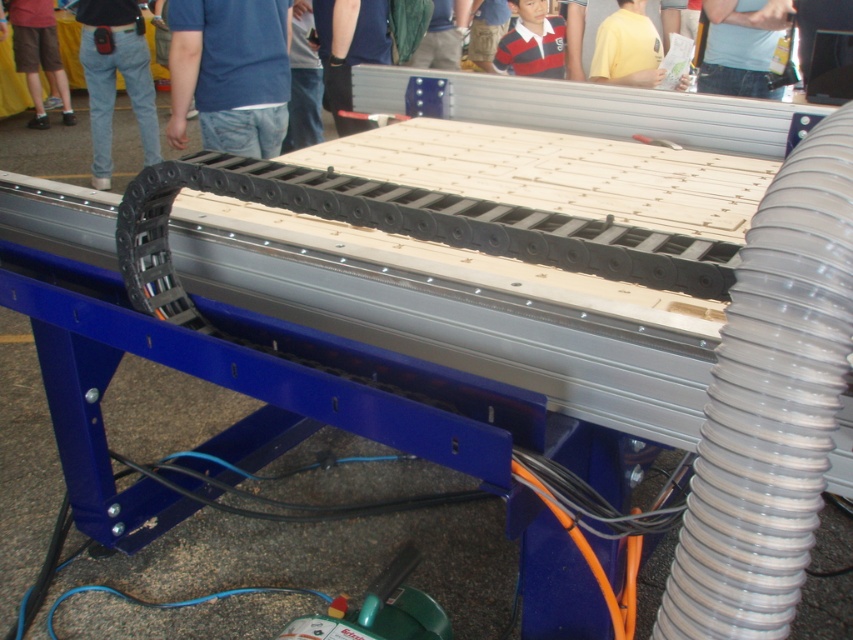
You are an engineer inspecting the machine. You notice two points marked on the machine surface. The first point is at coordinate point(99, 132) and the second at point(614, 61). From your vantage point, which point is closer to you?

Point(614, 61) is closer to you because it is in front of point(99, 132).